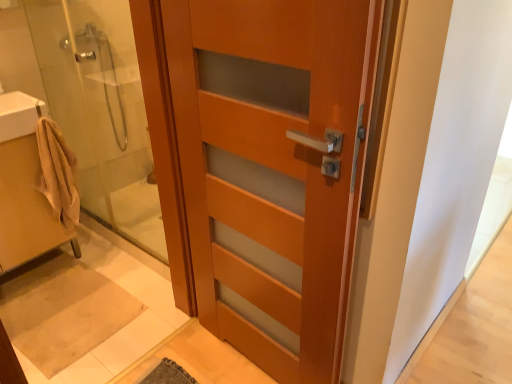
At what (x,y) coordinates should I click in order to perform the action: click on matte wood door at center. Please return your answer as a coordinate pair (x, y). The image size is (512, 384). Looking at the image, I should click on (111, 115).

Identify the location of matte wood door at center. The height and width of the screenshot is (384, 512). (273, 168).

Locate an element on the screen. beige fabric towel at left, which is the 2th sink in top-to-bottom order is located at coordinates (24, 187).

Identify the location of matte wood door at center. (111, 115).

Consider the image. From a real-world perspective, is matte wood door at center beneath beige cotton bathrobe at left?

Incorrect, from a real-world perspective, matte wood door at center is higher than beige cotton bathrobe at left.

Is matte wood door at center oriented towards beige cotton bathrobe at left?

No.

Based on the photo, how many degrees apart are the facing directions of matte wood door at center and beige cotton bathrobe at left?

The facing directions of matte wood door at center and beige cotton bathrobe at left are 90.7 degrees apart.

Which of these two, matte wood door at center or beige cotton bathrobe at left, is smaller?

beige cotton bathrobe at left.

Is beige cotton bathrobe at left in front of or behind beige fabric towel at left, arranged as the first sink when ordered from the bottom, in the image?

beige cotton bathrobe at left is behind beige fabric towel at left, arranged as the first sink when ordered from the bottom.

Where is `sink that is the 2nd object located in front of the beige cotton bathrobe at left`? Image resolution: width=512 pixels, height=384 pixels. sink that is the 2nd object located in front of the beige cotton bathrobe at left is located at coordinates (24, 187).

From the image's perspective, is beige cotton bathrobe at left above or below beige fabric towel at left, which is the 2th sink in top-to-bottom order?

beige cotton bathrobe at left is above beige fabric towel at left, which is the 2th sink in top-to-bottom order.

Is white glossy sink at upper left, which is the second sink in bottom-to-top order, inside beige fabric towel at left, which is the 2th sink in top-to-bottom order?

No, white glossy sink at upper left, which is the second sink in bottom-to-top order, is not surrounded by beige fabric towel at left, which is the 2th sink in top-to-bottom order.

Is beige fabric towel at left, arranged as the first sink when ordered from the bottom, looking in the opposite direction of white glossy sink at upper left, which is the second sink in bottom-to-top order?

No, beige fabric towel at left, arranged as the first sink when ordered from the bottom,'s orientation is not away from white glossy sink at upper left, which is the second sink in bottom-to-top order.

Considering the positions of point (24, 183) and point (18, 98), is point (24, 183) closer or farther from the camera than point (18, 98)?

Point (24, 183) is positioned farther from the camera compared to point (18, 98).

Relative to matte wood door at center, is matte wood door at center in front or behind?

matte wood door at center is positioned farther from the viewer than matte wood door at center.

Is matte wood door at center to the left of matte wood door at center from the viewer's perspective?

Correct, you'll find matte wood door at center to the left of matte wood door at center.

Could matte wood door at center be considered to be inside matte wood door at center?

No, matte wood door at center is located outside of matte wood door at center.

What's the angular difference between matte wood door at center and matte wood door at center's facing directions?

The angular difference between matte wood door at center and matte wood door at center is 90.5 degrees.

Between beige cotton bathrobe at left and matte wood door at center, which one has larger size?

matte wood door at center is bigger.

In the scene shown: Which is more to the left, beige cotton bathrobe at left or matte wood door at center?

From the viewer's perspective, beige cotton bathrobe at left appears more on the left side.

Is matte wood door at center completely or partially inside beige cotton bathrobe at left?

No.

Is white glossy sink at upper left, which is the first sink in top-to-bottom order, smaller than matte wood door at center?

Yes.

Based on the photo, is white glossy sink at upper left, which is the first sink in top-to-bottom order, turned away from matte wood door at center?

white glossy sink at upper left, which is the first sink in top-to-bottom order, is not turned away from matte wood door at center.

Can you confirm if white glossy sink at upper left, which is the first sink in top-to-bottom order, is wider than matte wood door at center?

Indeed, white glossy sink at upper left, which is the first sink in top-to-bottom order, has a greater width compared to matte wood door at center.

Which is in front, point (16, 94) or point (228, 42)?

Point (228, 42)

From the image's perspective, is beige fabric towel at left, which is the 2th sink in top-to-bottom order, beneath beige cotton bathrobe at left?

Yes, from the image's perspective, beige fabric towel at left, which is the 2th sink in top-to-bottom order, is below beige cotton bathrobe at left.

Looking at the image, does beige fabric towel at left, which is the 2th sink in top-to-bottom order, seem bigger or smaller compared to beige cotton bathrobe at left?

Clearly, beige fabric towel at left, which is the 2th sink in top-to-bottom order, is larger in size than beige cotton bathrobe at left.

Which is in front, point (15, 179) or point (41, 181)?

The point (15, 179) is closer to the camera.

I want to click on bathrobe on the left of matte wood door at center, so click(57, 173).

Where is `sink below the beige cotton bathrobe at left (from a real-world perspective)`? sink below the beige cotton bathrobe at left (from a real-world perspective) is located at coordinates (24, 187).

From the image, which object appears to be farther from beige fabric towel at left, which is the 2th sink in top-to-bottom order, matte wood door at center or matte wood door at center?

Based on the image, matte wood door at center appears to be further to beige fabric towel at left, which is the 2th sink in top-to-bottom order.

Looking at the image, which one is located further to matte wood door at center, matte wood door at center or beige fabric towel at left, arranged as the first sink when ordered from the bottom?

Among the two, beige fabric towel at left, arranged as the first sink when ordered from the bottom, is located further to matte wood door at center.

Looking at the image, which one is located further to beige cotton bathrobe at left, beige fabric towel at left, which is the 2th sink in top-to-bottom order, or matte wood door at center?

matte wood door at center lies further to beige cotton bathrobe at left than the other object.

In the scene shown: Considering their positions, is beige cotton bathrobe at left positioned closer to matte wood door at center than beige fabric towel at left, which is the 2th sink in top-to-bottom order?

beige cotton bathrobe at left is positioned closer to the anchor matte wood door at center.

From the image, which object appears to be farther from matte wood door at center, matte wood door at center or beige fabric towel at left, which is the 2th sink in top-to-bottom order?

matte wood door at center is further to matte wood door at center.

Estimate the real-world distances between objects in this image. Which object is further from beige cotton bathrobe at left, matte wood door at center or beige fabric towel at left, which is the 2th sink in top-to-bottom order?

Among the two, matte wood door at center is located further to beige cotton bathrobe at left.

Estimate the real-world distances between objects in this image. Which object is closer to white glossy sink at upper left, which is the second sink in bottom-to-top order, matte wood door at center or matte wood door at center?

matte wood door at center is positioned closer to the anchor white glossy sink at upper left, which is the second sink in bottom-to-top order.

From the image, which object appears to be nearer to beige cotton bathrobe at left, white glossy sink at upper left, which is the second sink in bottom-to-top order, or beige fabric towel at left, arranged as the first sink when ordered from the bottom?

beige fabric towel at left, arranged as the first sink when ordered from the bottom, lies closer to beige cotton bathrobe at left than the other object.

Identify the location of bathrobe between beige fabric towel at left, which is the 2th sink in top-to-bottom order, and matte wood door at center, in the horizontal direction. This screenshot has height=384, width=512. (57, 173).

The image size is (512, 384). In order to click on shower door between white glossy sink at upper left, which is the first sink in top-to-bottom order, and matte wood door at center in this screenshot , I will do `click(111, 115)`.

At what (x,y) coordinates should I click in order to perform the action: click on sink located between beige fabric towel at left, which is the 2th sink in top-to-bottom order, and matte wood door at center in the left-right direction. Please return your answer as a coordinate pair (x, y). Looking at the image, I should click on tap(19, 115).

Where is `sink positioned between matte wood door at center and white glossy sink at upper left, which is the second sink in bottom-to-top order, from near to far`? This screenshot has height=384, width=512. sink positioned between matte wood door at center and white glossy sink at upper left, which is the second sink in bottom-to-top order, from near to far is located at coordinates (24, 187).